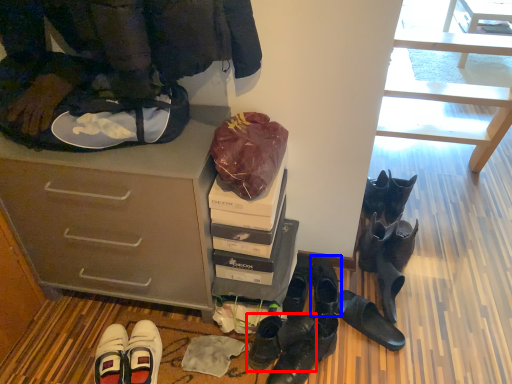
Question: Which object is further to the camera taking this photo, footwear (highlighted by a red box) or footwear (highlighted by a blue box)?

Choices:
 (A) footwear
 (B) footwear

Answer: (B)